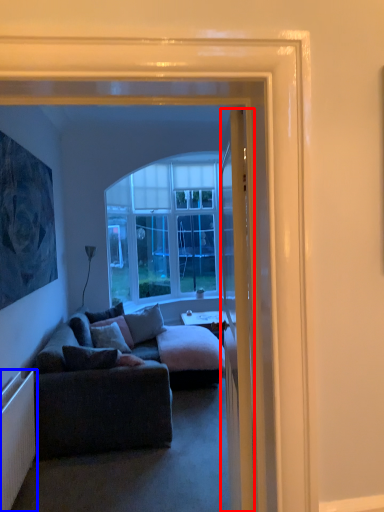
Question: Which of the following is the farthest to the observer, door (highlighted by a red box) or radiator (highlighted by a blue box)?

Choices:
 (A) door
 (B) radiator

Answer: (B)